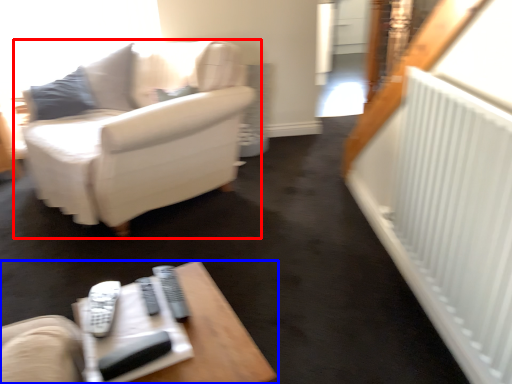
Question: Which of the following is the farthest to the observer, studio couch (highlighted by a red box) or table (highlighted by a blue box)?

Choices:
 (A) studio couch
 (B) table

Answer: (A)